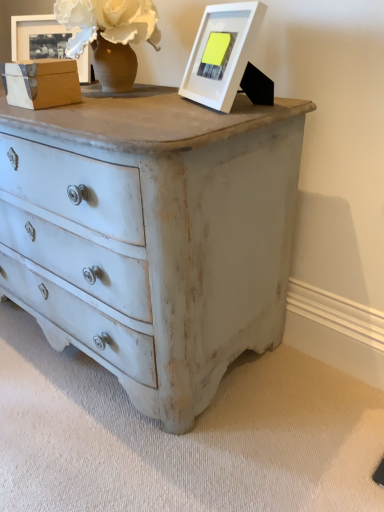
Question: Is white matte picture frame at upper center, positioned as the 2th picture frame in top-to-bottom order, in front of or behind matte wooden picture frame at upper left, which is counted as the 2th picture frame, starting from the right, in the image?

Choices:
 (A) behind
 (B) front

Answer: (B)

Question: Is white matte picture frame at upper center, placed as the first picture frame when sorted from front to back, wider or thinner than matte wooden picture frame at upper left, which is counted as the 2th picture frame, starting from the right?

Choices:
 (A) thin
 (B) wide

Answer: (B)

Question: Looking at the image, does white matte picture frame at upper center, arranged as the second picture frame when viewed from the left, seem bigger or smaller compared to matte wooden picture frame at upper left, which is the second picture frame from bottom to top?

Choices:
 (A) small
 (B) big

Answer: (B)

Question: Is matte wooden picture frame at upper left, which is counted as the 2th picture frame, starting from the right, spatially inside white matte picture frame at upper center, marked as the 2th picture frame in a back-to-front arrangement, or outside of it?

Choices:
 (A) inside
 (B) outside

Answer: (B)

Question: Is matte wooden picture frame at upper left, the first picture frame positioned from the left, in front of or behind white matte picture frame at upper center, placed as the first picture frame when sorted from front to back, in the image?

Choices:
 (A) behind
 (B) front

Answer: (A)

Question: In terms of width, does matte wooden picture frame at upper left, the 2th picture frame in the front-to-back sequence, look wider or thinner when compared to white matte picture frame at upper center, which is the first picture frame in right-to-left order?

Choices:
 (A) wide
 (B) thin

Answer: (B)

Question: From a real-world perspective, is matte wooden picture frame at upper left, marked as the 1th picture frame in a back-to-front arrangement, physically located above or below white matte picture frame at upper center, which is the first picture frame in right-to-left order?

Choices:
 (A) above
 (B) below

Answer: (A)